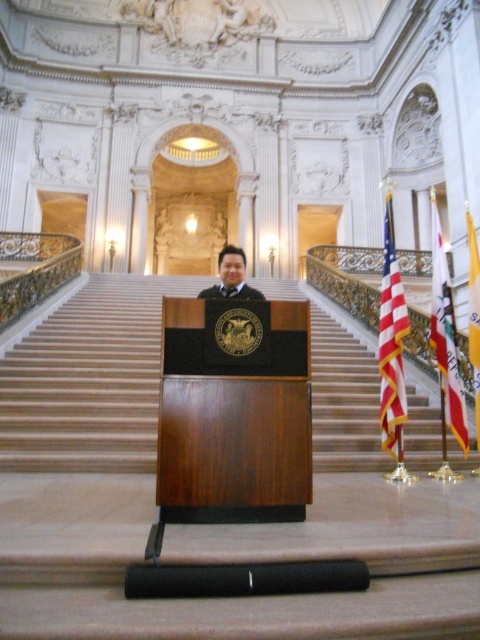
Question: Can you confirm if white fabric flag at center is positioned above dark brown suit at center?

Choices:
 (A) no
 (B) yes

Answer: (A)

Question: Based on their relative distances, which object is nearer to the white fabric flag at center?

Choices:
 (A) american flag at right
 (B) dark brown suit at center

Answer: (A)

Question: Among these objects, which one is nearest to the camera?

Choices:
 (A) white fabric flag at center
 (B) wooden staircase at center
 (C) american flag at right

Answer: (A)

Question: Is wooden staircase at center smaller than american flag at right?

Choices:
 (A) yes
 (B) no

Answer: (A)

Question: Among these objects, which one is nearest to the camera?

Choices:
 (A) white fabric flag at center
 (B) dark brown suit at center
 (C) american flag at right
 (D) silky yellow flag at right

Answer: (B)

Question: Considering the relative positions of american flag at right and dark brown suit at center in the image provided, where is american flag at right located with respect to dark brown suit at center?

Choices:
 (A) left
 (B) right

Answer: (B)